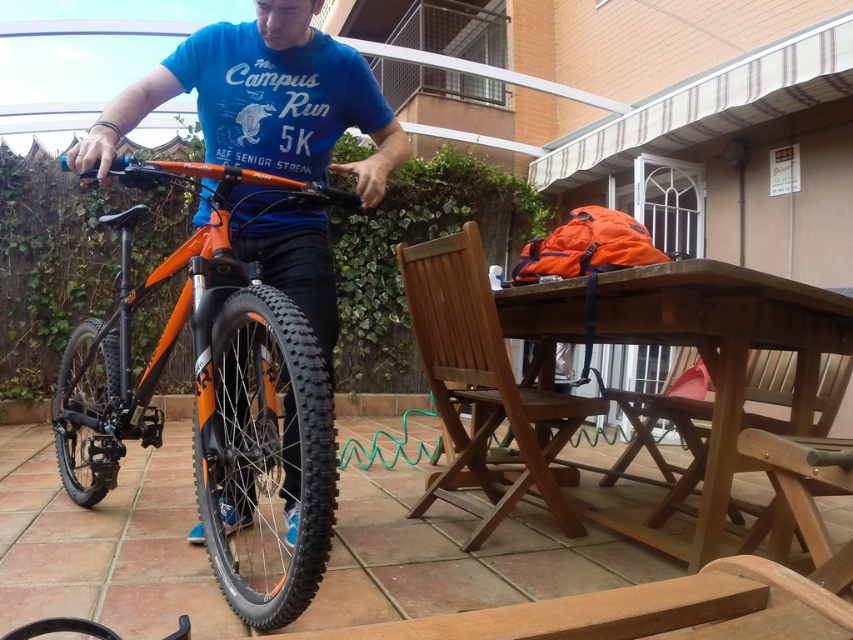
Question: Does orange matte bicycle at center have a larger size compared to brown wooden table at center?

Choices:
 (A) no
 (B) yes

Answer: (A)

Question: Can you confirm if orange matte bicycle at center is positioned above brown wooden table at center?

Choices:
 (A) no
 (B) yes

Answer: (B)

Question: Is orange matte bicycle at center below brown wooden table at center?

Choices:
 (A) no
 (B) yes

Answer: (A)

Question: Which of the following is the closest to the observer?

Choices:
 (A) brown wooden table at center
 (B) orange matte bicycle at center

Answer: (B)

Question: Which point appears farthest from the camera in this image?

Choices:
 (A) (850, 326)
 (B) (312, 218)

Answer: (B)